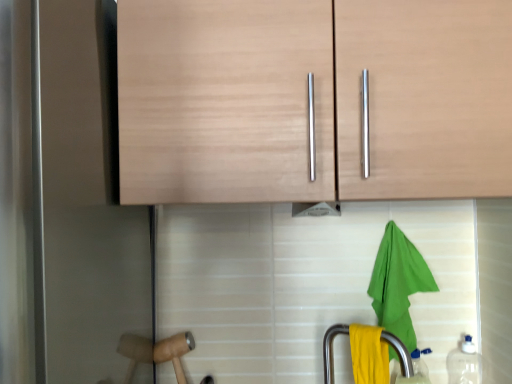
Question: Is green fabric towel at lower right oriented towards wooden hammer at lower left?

Choices:
 (A) yes
 (B) no

Answer: (B)

Question: Can you confirm if green fabric towel at lower right is taller than wooden hammer at lower left?

Choices:
 (A) yes
 (B) no

Answer: (A)

Question: From a real-world perspective, is green fabric towel at lower right located higher than wooden hammer at lower left?

Choices:
 (A) no
 (B) yes

Answer: (B)

Question: Does green fabric towel at lower right have a smaller size compared to wooden hammer at lower left?

Choices:
 (A) no
 (B) yes

Answer: (A)

Question: Is green fabric towel at lower right wider than wooden hammer at lower left?

Choices:
 (A) no
 (B) yes

Answer: (B)

Question: From the image's perspective, relative to transparent plastic bottle at lower right, the 2th bottle viewed from the left, is yellow matte towel at lower center above or below?

Choices:
 (A) above
 (B) below

Answer: (A)

Question: Is point (x=345, y=329) closer or farther from the camera than point (x=480, y=380)?

Choices:
 (A) farther
 (B) closer

Answer: (B)

Question: Considering their positions, is yellow matte towel at lower center located in front of or behind transparent plastic bottle at lower right, which is the 1th bottle in right-to-left order?

Choices:
 (A) behind
 (B) front

Answer: (B)

Question: Is yellow matte towel at lower center situated inside transparent plastic bottle at lower right, the 2th bottle viewed from the left, or outside?

Choices:
 (A) outside
 (B) inside

Answer: (A)

Question: Considering the positions of point (324, 342) and point (183, 382), is point (324, 342) closer or farther from the camera than point (183, 382)?

Choices:
 (A) farther
 (B) closer

Answer: (A)

Question: Based on their sizes in the image, would you say yellow matte towel at lower center is bigger or smaller than wooden hammer at lower left?

Choices:
 (A) small
 (B) big

Answer: (B)

Question: Is yellow matte towel at lower center wider or thinner than wooden hammer at lower left?

Choices:
 (A) wide
 (B) thin

Answer: (B)

Question: In terms of height, does yellow matte towel at lower center look taller or shorter compared to wooden hammer at lower left?

Choices:
 (A) tall
 (B) short

Answer: (A)

Question: Based on their positions, is light wood cabinet at upper center located to the left or right of wooden hammer at lower left?

Choices:
 (A) left
 (B) right

Answer: (B)

Question: Is point pyautogui.click(x=507, y=170) positioned closer to the camera than point pyautogui.click(x=177, y=337)?

Choices:
 (A) farther
 (B) closer

Answer: (B)